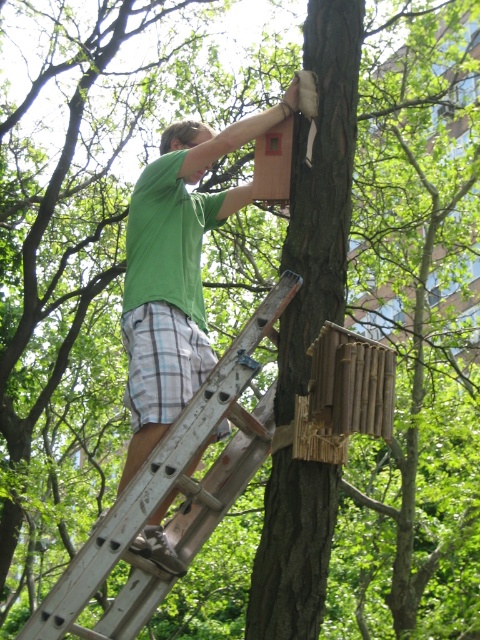
In the scene shown: Is wooden ladder at center thinner than wooden birdhouse at upper center?

Incorrect, wooden ladder at center's width is not less than wooden birdhouse at upper center's.

Between wooden ladder at center and wooden birdhouse at upper center, which one appears on the left side from the viewer's perspective?

Positioned to the left is wooden ladder at center.

Find the location of `wooden ladder at center`. wooden ladder at center is located at coordinates (169, 488).

Between green matte shirt at upper center and natural wood birdhouse at center, which one is positioned lower?

natural wood birdhouse at center

Which is above, green matte shirt at upper center or natural wood birdhouse at center?

green matte shirt at upper center is above.

Where is `green matte shirt at upper center`? The height and width of the screenshot is (640, 480). green matte shirt at upper center is located at coordinates (176, 272).

In the scene shown: Can you confirm if green matte shirt at upper center is bigger than wooden ladder at center?

Yes.

Does green matte shirt at upper center appear on the left side of wooden ladder at center?

In fact, green matte shirt at upper center is to the right of wooden ladder at center.

Does point (136, 433) lie behind point (256, 369)?

That is True.

What are the coordinates of `green matte shirt at upper center` in the screenshot? It's located at (176, 272).